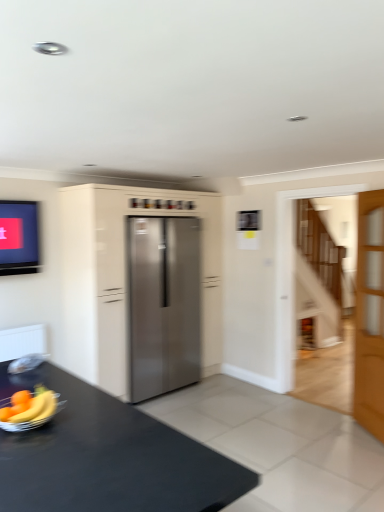
Question: Considering the relative sizes of light brown wooden door at right and stainless steel refrigerator at center in the image provided, is light brown wooden door at right smaller than stainless steel refrigerator at center?

Choices:
 (A) no
 (B) yes

Answer: (B)

Question: Considering the relative sizes of light brown wooden door at right and stainless steel refrigerator at center in the image provided, is light brown wooden door at right thinner than stainless steel refrigerator at center?

Choices:
 (A) yes
 (B) no

Answer: (A)

Question: Does light brown wooden door at right have a greater height compared to stainless steel refrigerator at center?

Choices:
 (A) yes
 (B) no

Answer: (B)

Question: From the image's perspective, is light brown wooden door at right located beneath stainless steel refrigerator at center?

Choices:
 (A) yes
 (B) no

Answer: (A)

Question: Is light brown wooden door at right shorter than stainless steel refrigerator at center?

Choices:
 (A) yes
 (B) no

Answer: (A)

Question: From a real-world perspective, is light brown wooden door at right positioned above or below stainless steel refrigerator at center?

Choices:
 (A) above
 (B) below

Answer: (A)

Question: Is point (365, 259) positioned closer to the camera than point (158, 393)?

Choices:
 (A) closer
 (B) farther

Answer: (B)

Question: From the image's perspective, relative to stainless steel refrigerator at center, is light brown wooden door at right above or below?

Choices:
 (A) above
 (B) below

Answer: (A)

Question: Is light brown wooden door at right taller or shorter than stainless steel refrigerator at center?

Choices:
 (A) tall
 (B) short

Answer: (A)

Question: Looking at their shapes, would you say yellow matte banana at lower left is wider or thinner than light brown wooden door at right?

Choices:
 (A) thin
 (B) wide

Answer: (B)

Question: Considering the positions of yellow matte banana at lower left and light brown wooden door at right in the image, is yellow matte banana at lower left bigger or smaller than light brown wooden door at right?

Choices:
 (A) big
 (B) small

Answer: (B)

Question: Considering their positions, is yellow matte banana at lower left located in front of or behind light brown wooden door at right?

Choices:
 (A) behind
 (B) front

Answer: (B)

Question: Would you say yellow matte banana at lower left is inside or outside light brown wooden door at right?

Choices:
 (A) inside
 (B) outside

Answer: (B)

Question: Is black matte table at lower left situated inside stainless steel refrigerator at center or outside?

Choices:
 (A) outside
 (B) inside

Answer: (A)

Question: Considering the positions of black matte table at lower left and stainless steel refrigerator at center in the image, is black matte table at lower left taller or shorter than stainless steel refrigerator at center?

Choices:
 (A) short
 (B) tall

Answer: (A)